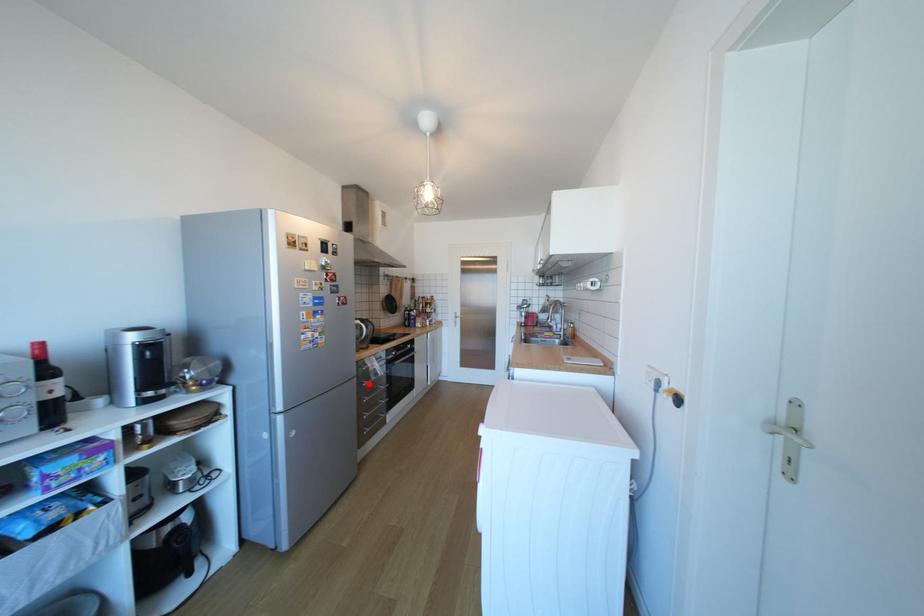
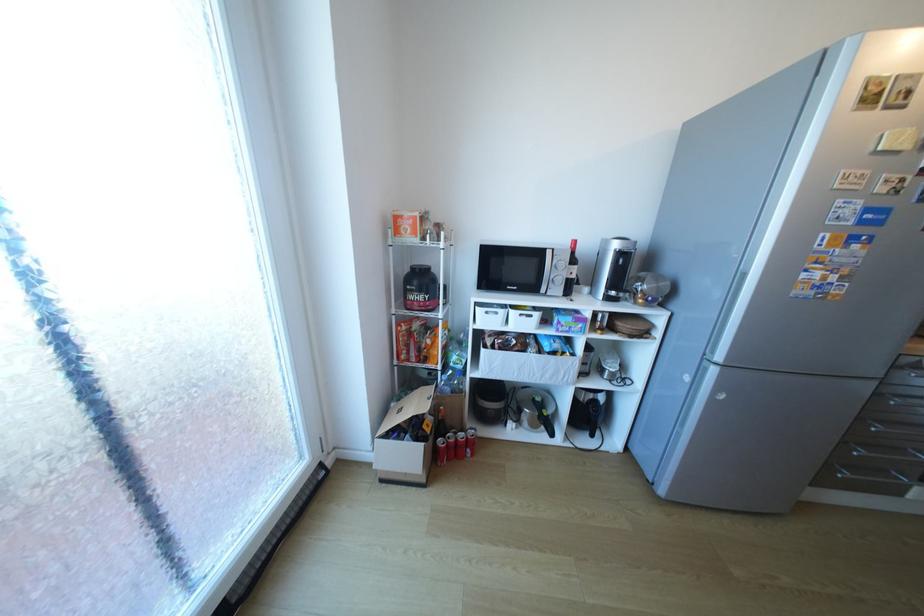
Locate, in the second image, the point that corresponds to the highlighted location in the first image.

(886, 395)